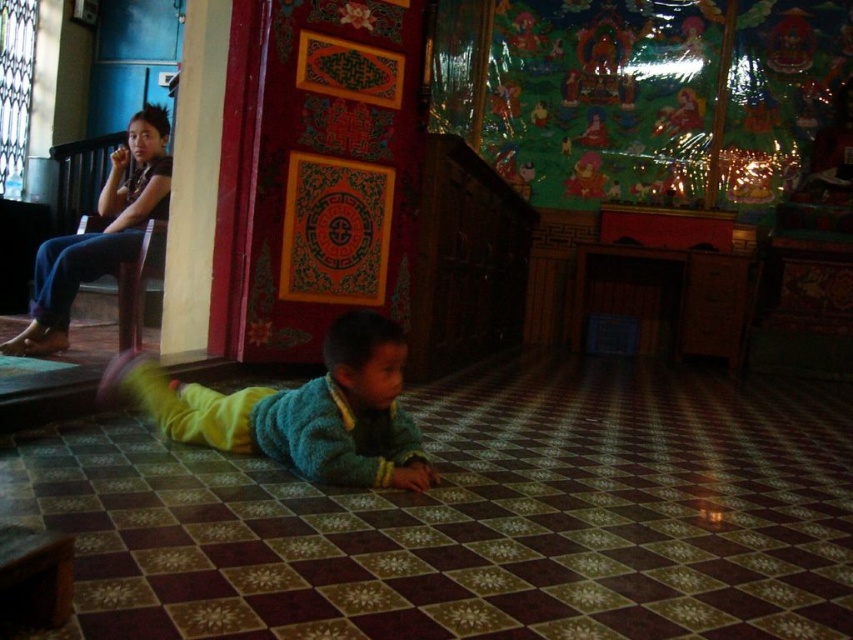
You are standing in the temple and want to take a photo of the point at coordinates (x=379, y=314). Is this point within your camera frame? The camera has a 60 degree field of view and you are 2 meters away from the point. The temple is 10 meters wide.

The point at coordinates (x=379, y=314) is 2.06 meters away from the camera. Since the camera has a 60 degree field of view, the maximum distance it can capture horizontally is calculated using trigonometry. The half of the field of view is 30 degrees. The horizontal distance covered would be 2.06 meters multiplied by tan 30 degrees, which is approximately 2.06 m x 0.577, resulting in about 1.19 meters. The temple is 10 meters wide, so the point is well within the camera frame.

You are a tour guide in this temple. A visitor asks if they can place a small offering between the knitted green sweater at center and the jeans at left. The offering requires 5 feet of space. Can they fit it there?

The knitted green sweater at center and jeans at left are 4.93 feet apart from each other. Since the required space is 5 feet, the offering cannot fit there as the available space is slightly less.

Based on the photo, you are a visitor in the temple and you see the knitted green sweater at center and the jeans at left. Which item is closer to the floor?

The knitted green sweater at center is located below jeans at left, so it is closer to the floor.